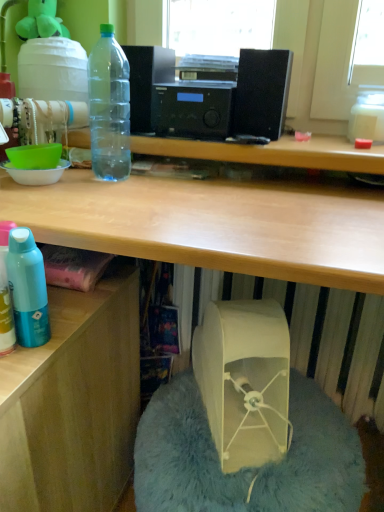
Question: Could beige fabric bean bag chair at lower center be considered to be inside beige fabric bag at lower center?

Choices:
 (A) yes
 (B) no

Answer: (B)

Question: Is the depth of beige fabric bag at lower center greater than that of beige fabric bean bag chair at lower center?

Choices:
 (A) no
 (B) yes

Answer: (B)

Question: From a real-world perspective, does beige fabric bag at lower center stand above beige fabric bean bag chair at lower center?

Choices:
 (A) yes
 (B) no

Answer: (A)

Question: Does beige fabric bag at lower center appear on the left side of beige fabric bean bag chair at lower center?

Choices:
 (A) yes
 (B) no

Answer: (A)

Question: From a real-world perspective, is beige fabric bag at lower center physically below beige fabric bean bag chair at lower center?

Choices:
 (A) yes
 (B) no

Answer: (B)

Question: In terms of height, does beige fabric bag at lower center look taller or shorter compared to transparent plastic water cooler at upper left?

Choices:
 (A) tall
 (B) short

Answer: (A)

Question: Is beige fabric bag at lower center situated inside transparent plastic water cooler at upper left or outside?

Choices:
 (A) outside
 (B) inside

Answer: (A)

Question: Considering the positions of beige fabric bag at lower center and transparent plastic water cooler at upper left in the image, is beige fabric bag at lower center bigger or smaller than transparent plastic water cooler at upper left?

Choices:
 (A) small
 (B) big

Answer: (B)

Question: In the image, is beige fabric bag at lower center positioned in front of or behind transparent plastic water cooler at upper left?

Choices:
 (A) front
 (B) behind

Answer: (A)

Question: Based on their positions, is wooden desk at lower left located to the left or right of transparent plastic bottle at upper left?

Choices:
 (A) left
 (B) right

Answer: (A)

Question: Relative to transparent plastic bottle at upper left, is wooden desk at lower left in front or behind?

Choices:
 (A) behind
 (B) front

Answer: (B)

Question: Based on their sizes in the image, would you say wooden desk at lower left is bigger or smaller than transparent plastic bottle at upper left?

Choices:
 (A) small
 (B) big

Answer: (B)

Question: Is wooden desk at lower left inside the boundaries of transparent plastic bottle at upper left, or outside?

Choices:
 (A) outside
 (B) inside

Answer: (A)

Question: Looking at their shapes, would you say transparent plastic water cooler at upper left is wider or thinner than transparent plastic bottle at upper left?

Choices:
 (A) wide
 (B) thin

Answer: (A)

Question: In terms of size, does transparent plastic water cooler at upper left appear bigger or smaller than transparent plastic bottle at upper left?

Choices:
 (A) small
 (B) big

Answer: (B)